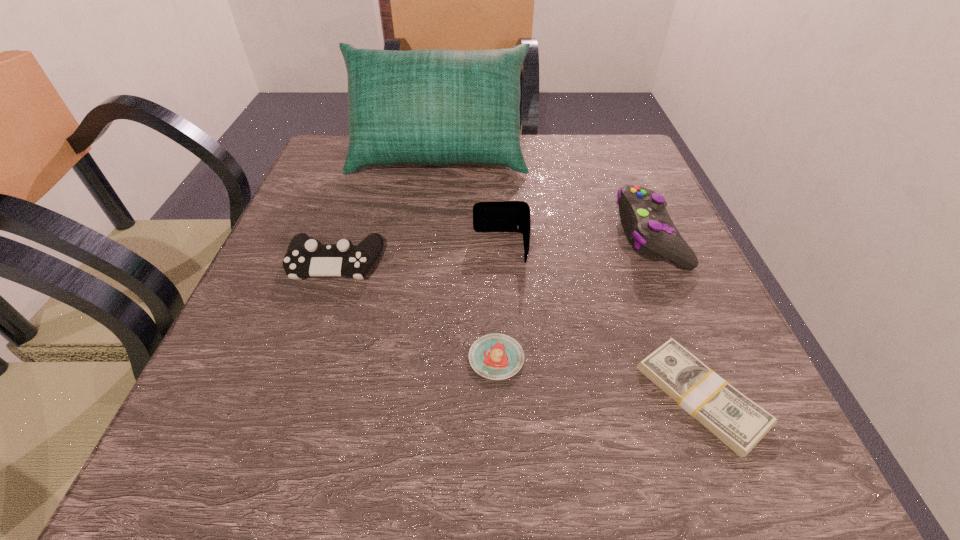
The image size is (960, 540). Identify the location of vacant region located 0.220m on the outer surface of the wallet. (353, 248).

The height and width of the screenshot is (540, 960). Find the location of `free space located 0.180m on the outer surface of the wallet`. free space located 0.180m on the outer surface of the wallet is located at coordinates (375, 248).

This screenshot has height=540, width=960. I want to click on vacant space located 0.270m on the outer surface of the wallet, so click(x=326, y=248).

This screenshot has height=540, width=960. What are the coordinates of `vacant space located on the surface of the shorter control` in the screenshot? It's located at (268, 465).

Identify the location of free space located on the left of the second shortest object. (379, 358).

The image size is (960, 540). I want to click on vacant space situated 0.140m on the back of the shortest object, so click(654, 278).

Where is `object present at the far edge`? object present at the far edge is located at coordinates (434, 107).

You are a GUI agent. You are given a task and a screenshot of the screen. Output one action in this format:
    pyautogui.click(x=<x>, y=<y>)
    Task: Click on the object located in the near edge section of the desktop
    This screenshot has width=960, height=540.
    Given the screenshot: What is the action you would take?
    pyautogui.click(x=737, y=421)

Find the location of a particular element. cushion at the left edge is located at coordinates (434, 107).

You are a GUI agent. You are given a task and a screenshot of the screen. Output one action in this format:
    pyautogui.click(x=<x>, y=<y>)
    Task: Click on the control at the left edge
    This screenshot has height=540, width=960.
    Given the screenshot: What is the action you would take?
    pyautogui.click(x=305, y=257)